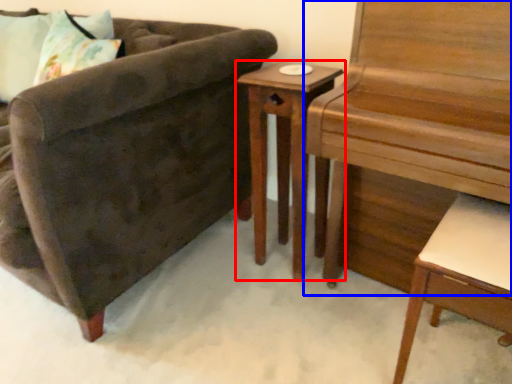
Question: Among these objects, which one is farthest to the camera, nightstand (highlighted by a red box) or piano (highlighted by a blue box)?

Choices:
 (A) nightstand
 (B) piano

Answer: (A)